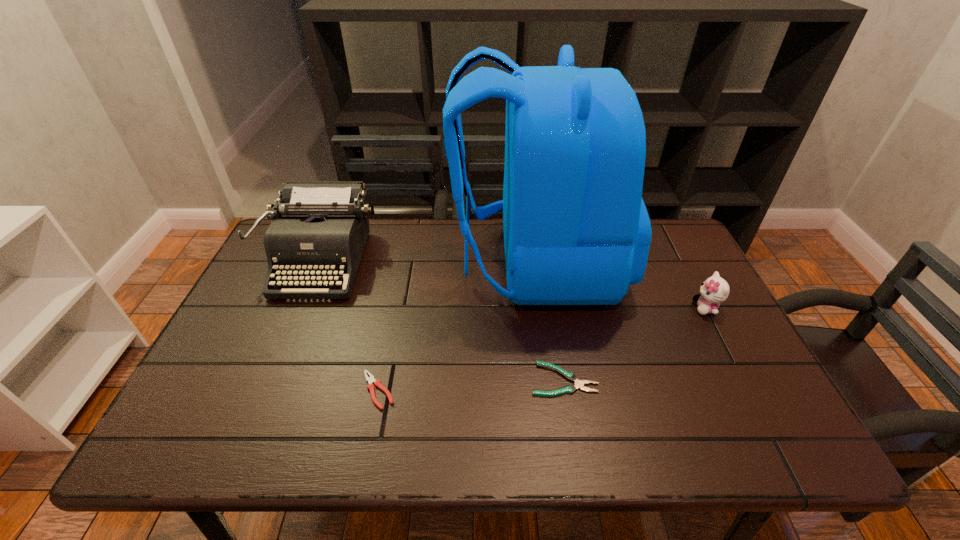
Find the location of `empty space between the right pliers and the left pliers`. empty space between the right pliers and the left pliers is located at coordinates (471, 385).

I want to click on free space between the left pliers and the kitten, so click(x=542, y=349).

Locate an element on the screen. empty space that is in between the right pliers and the tallest object is located at coordinates (550, 321).

What are the coordinates of `empty location between the right pliers and the leftmost object` in the screenshot? It's located at (443, 320).

You are a GUI agent. You are given a task and a screenshot of the screen. Output one action in this format:
    pyautogui.click(x=<x>, y=<y>)
    Task: Click on the free space between the tallest object and the right pliers
    This screenshot has width=960, height=540.
    Given the screenshot: What is the action you would take?
    pyautogui.click(x=550, y=321)

Where is `vacant area that lies between the tallest object and the leftmost object`? The height and width of the screenshot is (540, 960). vacant area that lies between the tallest object and the leftmost object is located at coordinates (429, 261).

Where is `object that is the fourth nearest to the backpack`? Image resolution: width=960 pixels, height=540 pixels. object that is the fourth nearest to the backpack is located at coordinates (319, 229).

Find the location of `the second closest object to the tallest object`. the second closest object to the tallest object is located at coordinates (579, 384).

The height and width of the screenshot is (540, 960). Identify the location of free space that satisfies the following two spatial constraints: 1. on the front-facing side of the leftmost object; 2. on the right side of the left pliers. (266, 390).

Find the location of a particular element. free space in the image that satisfies the following two spatial constraints: 1. on the back side of the left pliers; 2. on the left side of the right pliers is located at coordinates (380, 380).